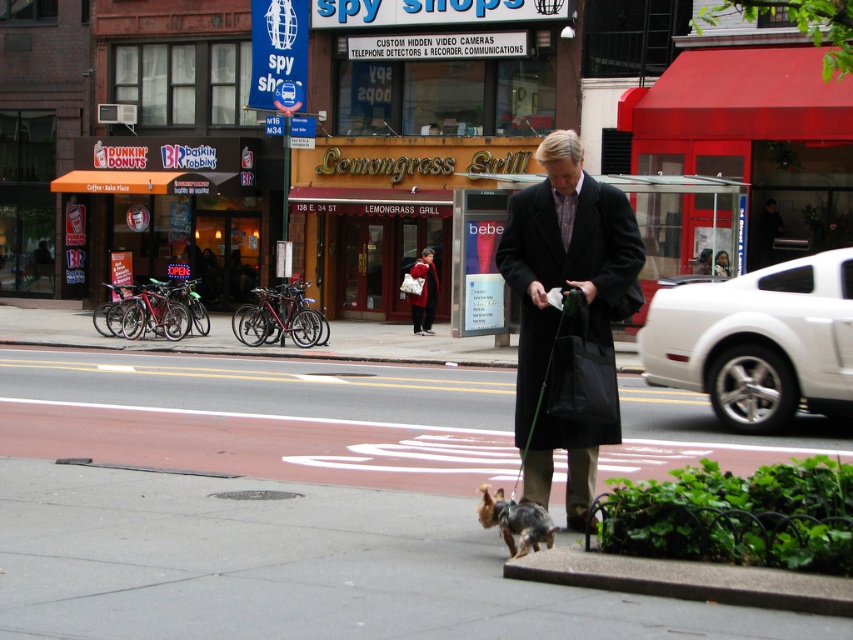
You are a pedestrian standing on the street. You see the smooth asphalt pavement at center and the shiny brown fur at center. Which object is closer to your feet?

The smooth asphalt pavement at center is closer to your feet because it is located below the shiny brown fur at center.

You are a delivery person with a package that requires a flat surface to place. You see the smooth asphalt pavement at center and the shiny brown fur at center. Which surface is more suitable for placing the package?

The smooth asphalt pavement at center is more suitable for placing the package because it is a flat surface, whereas the shiny brown fur at center is likely part of an animal and not a stable surface.